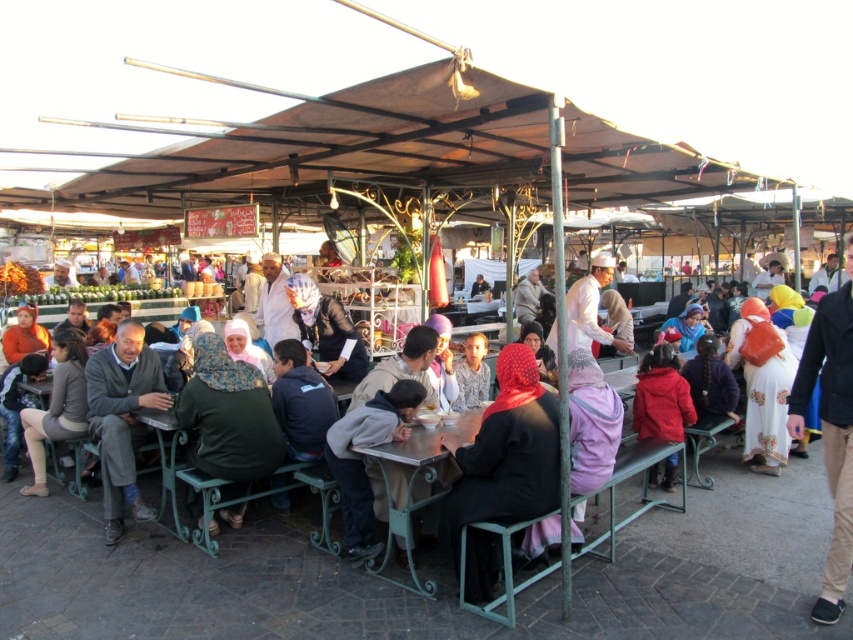
What do you see at coordinates (505, 456) in the screenshot? The height and width of the screenshot is (640, 853). I see `black fabric headscarf at center` at bounding box center [505, 456].

Which is above, black fabric headscarf at center or gray matte jacket at center?

black fabric headscarf at center

Describe the element at coordinates (505, 456) in the screenshot. The image size is (853, 640). I see `black fabric headscarf at center` at that location.

You are a GUI agent. You are given a task and a screenshot of the screen. Output one action in this format:
    pyautogui.click(x=<x>, y=<y>)
    Task: Click on the black fabric headscarf at center
    This screenshot has height=640, width=853.
    Given the screenshot: What is the action you would take?
    pyautogui.click(x=505, y=456)

Can you confirm if khaki cotton pants at right is positioned below matte black helmet at center?

Indeed, khaki cotton pants at right is positioned under matte black helmet at center.

Is point (831, 412) behind point (316, 358)?

No.

Identify the location of khaki cotton pants at right. The image size is (853, 640). (830, 428).

Does black fabric headscarf at center appear under khaki cotton pants at right?

Correct, black fabric headscarf at center is located below khaki cotton pants at right.

Can you confirm if black fabric headscarf at center is smaller than khaki cotton pants at right?

Yes, black fabric headscarf at center is smaller than khaki cotton pants at right.

Which is in front, point (509, 515) or point (819, 621)?

Point (819, 621) is in front.

Image resolution: width=853 pixels, height=640 pixels. I want to click on black fabric headscarf at center, so click(505, 456).